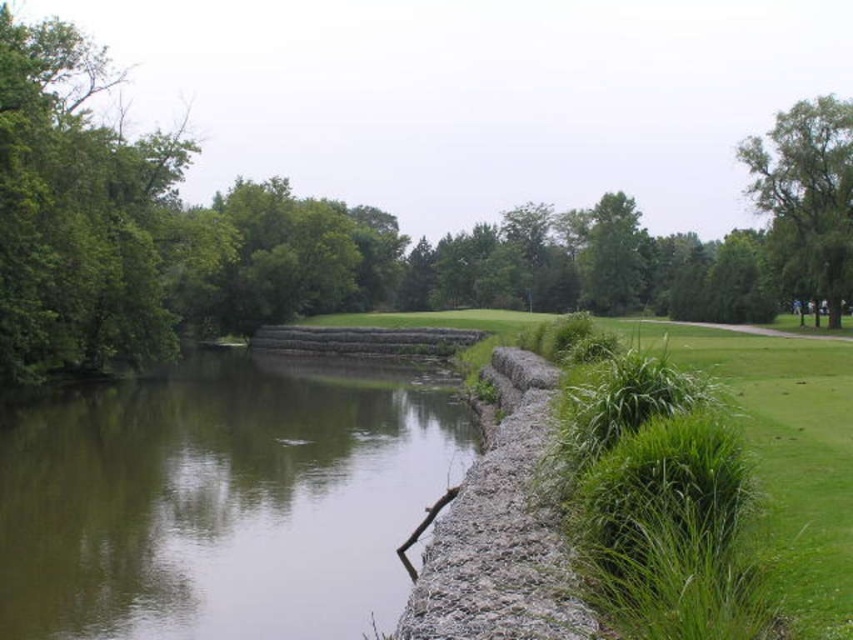
You are standing at the center of the grassy area on the right side of the pond. Which direction should you look to see the green leafy tree at upper left?

The green leafy tree at upper left is located at point 0.366 in the x coordinate and 0.242 in the y coordinate, so you should look towards the upper left direction to see it.

You are standing at the center of the grassy area on the right side of the image. Which direction should you walk to reach the green leafy tree at upper left located at point (206, 234)?

The green leafy tree at upper left is located at point (206, 234), so you should walk towards the upper left direction to reach it.